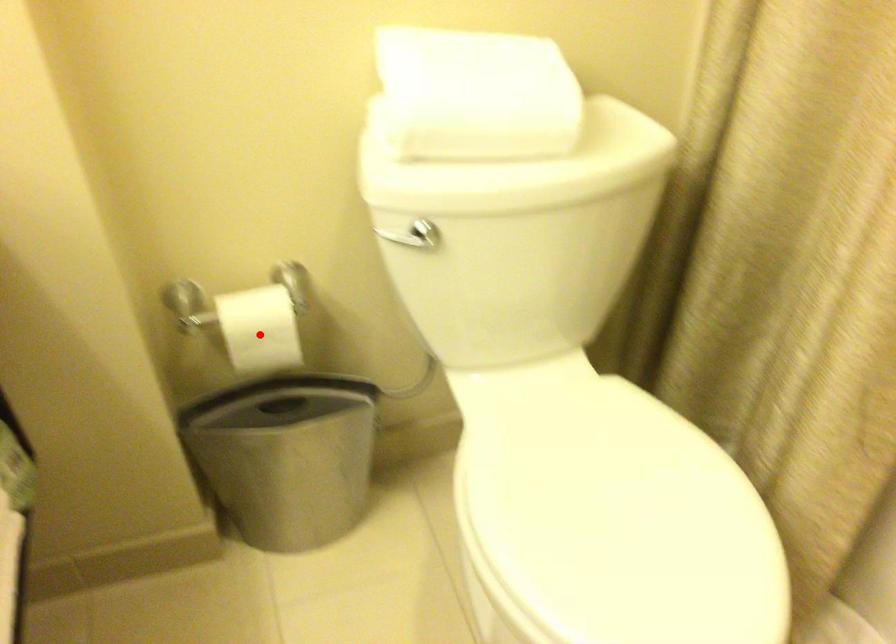
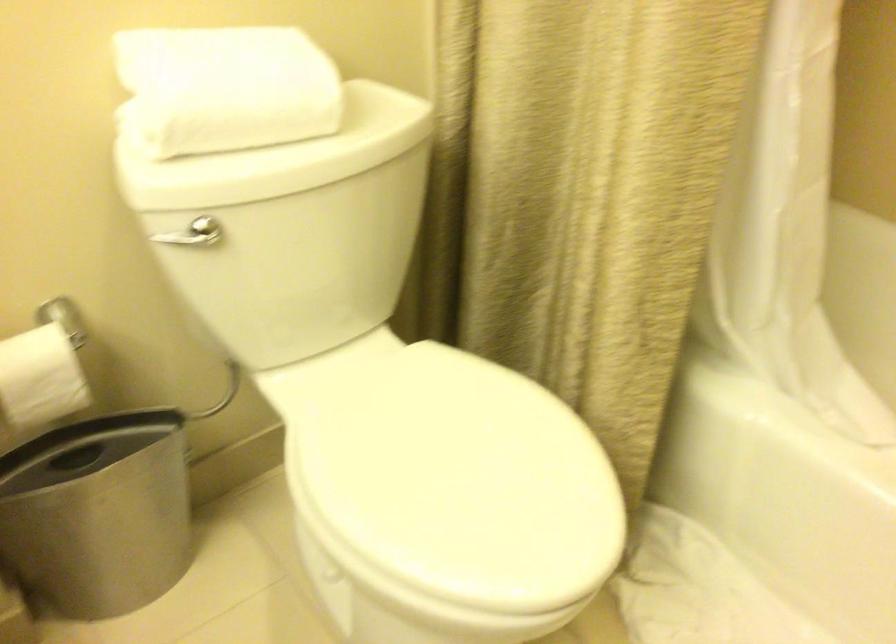
In the second image, find the point that corresponds to the highlighted location in the first image.

(39, 377)